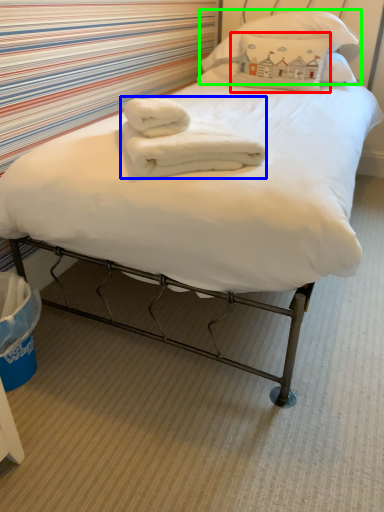
Question: Based on their relative distances, which object is farther from pillow (highlighted by a red box)? Choose from bath towel (highlighted by a blue box) and pillow (highlighted by a green box).

Choices:
 (A) bath towel
 (B) pillow

Answer: (A)